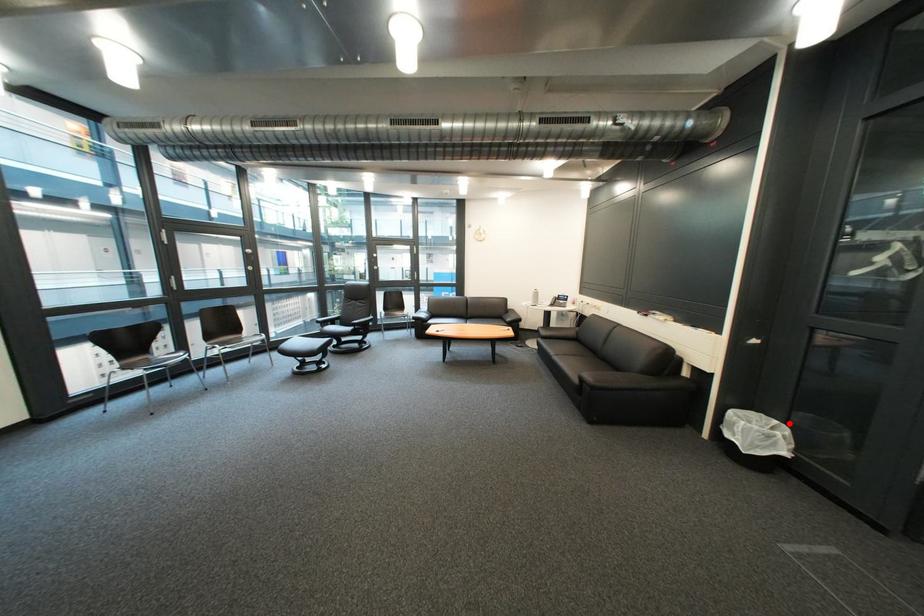
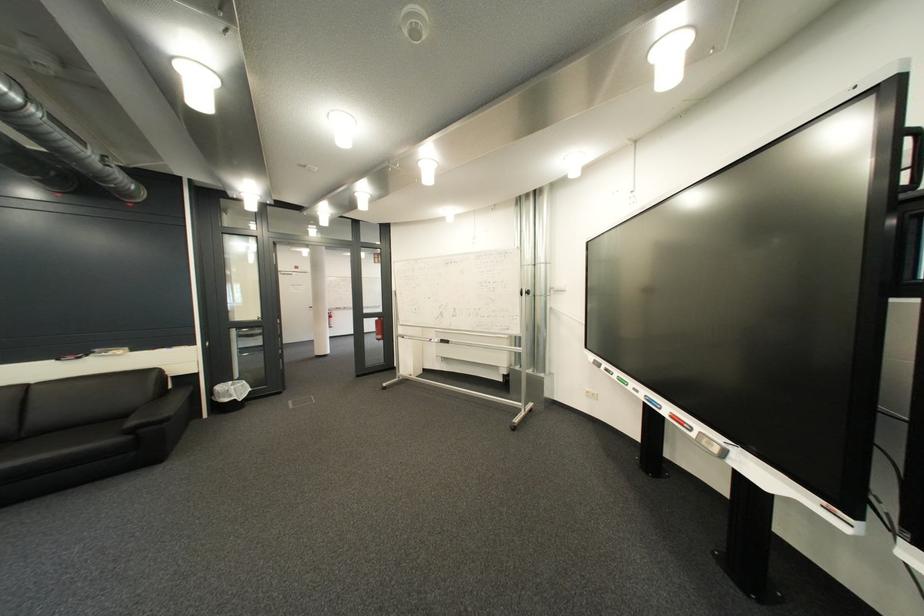
Find the pixel in the second image that matches the highlighted location in the first image.

(245, 384)